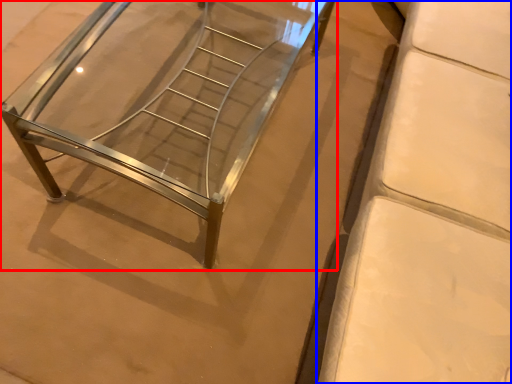
Question: Among these objects, which one is nearest to the camera, furniture (highlighted by a red box) or furniture (highlighted by a blue box)?

Choices:
 (A) furniture
 (B) furniture

Answer: (B)